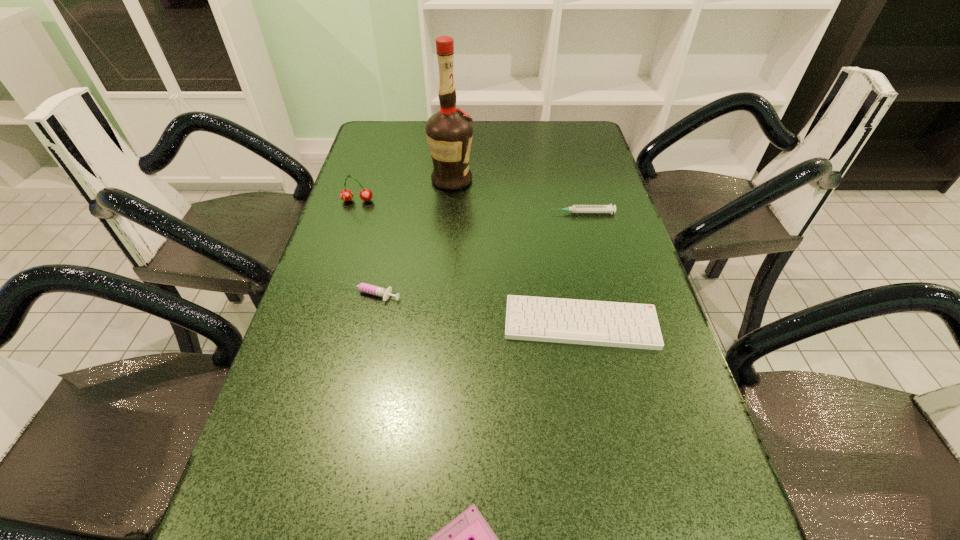
Locate an element on the screen. the tallest object is located at coordinates (449, 132).

Where is `liquor`? The width and height of the screenshot is (960, 540). liquor is located at coordinates (449, 132).

At what (x,y) coordinates should I click in order to perform the action: click on the fifth nearest object. Please return your answer as a coordinate pair (x, y). The height and width of the screenshot is (540, 960). Looking at the image, I should click on (346, 195).

Locate an element on the screen. The width and height of the screenshot is (960, 540). the second tallest object is located at coordinates point(346,195).

I want to click on the farther syringe, so click(575, 208).

You are a GUI agent. You are given a task and a screenshot of the screen. Output one action in this format:
    pyautogui.click(x=<x>, y=<y>)
    Task: Click on the third farthest object
    The height and width of the screenshot is (540, 960).
    Given the screenshot: What is the action you would take?
    pyautogui.click(x=575, y=208)

Where is `the left syringe`? Image resolution: width=960 pixels, height=540 pixels. the left syringe is located at coordinates (378, 291).

The width and height of the screenshot is (960, 540). Find the location of `the fifth tallest object`. the fifth tallest object is located at coordinates (615, 324).

You are a GUI agent. You are given a task and a screenshot of the screen. Output one action in this format:
    pyautogui.click(x=<x>, y=<y>)
    Task: Click on the vacant space situated on the front and back of the farthest object
    The width and height of the screenshot is (960, 540).
    Given the screenshot: What is the action you would take?
    pyautogui.click(x=516, y=180)

Identify the location of free space located with stems pointing upwards on the fifth shortest object. This screenshot has width=960, height=540. (328, 290).